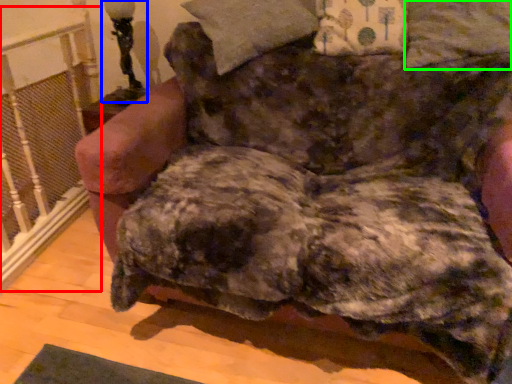
Question: Based on their relative distances, which object is farther from rail (highlighted by a red box)? Choose from table lamp (highlighted by a blue box) and pillow (highlighted by a green box).

Choices:
 (A) table lamp
 (B) pillow

Answer: (B)